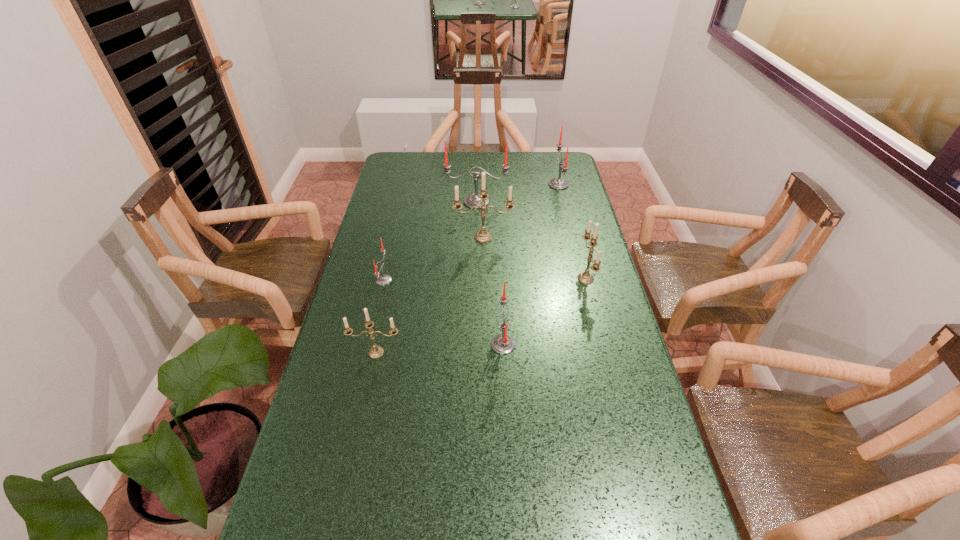
Locate an element on the screen. The width and height of the screenshot is (960, 540). empty location between the rightmost red candle and the second smallest red candle is located at coordinates (531, 265).

Find the location of `unoccupied area between the third smallest red candle and the shortest object`. unoccupied area between the third smallest red candle and the shortest object is located at coordinates (471, 232).

Find the location of `vacant area that lies between the second metallic candle from left to right and the second smallest metallic candle`. vacant area that lies between the second metallic candle from left to right and the second smallest metallic candle is located at coordinates (535, 258).

At what (x,y) coordinates should I click in order to perform the action: click on unoccupied position between the farthest metallic candle and the smallest metallic candle. Please return your answer as a coordinate pair (x, y). This screenshot has width=960, height=540. Looking at the image, I should click on (430, 295).

I want to click on empty space between the third biggest red candle and the second smallest metallic candle, so click(x=544, y=312).

Select which object appears as the fifth closest to the third farthest object. Please provide its 2D coordinates. Your answer should be formatted as a tuple, i.e. [(x, y)], where the tuple contains the x and y coordinates of a point satisfying the conditions above.

[(503, 344)]

Identify which object is the fourth closest to the second farthest metallic candle. Please provide its 2D coordinates. Your answer should be formatted as a tuple, i.e. [(x, y)], where the tuple contains the x and y coordinates of a point satisfying the conditions above.

[(558, 183)]

Identify which candle is the sixth nearest to the second biggest metallic candle. Please provide its 2D coordinates. Your answer should be formatted as a tuple, i.e. [(x, y)], where the tuple contains the x and y coordinates of a point satisfying the conditions above.

[(383, 279)]

Locate which candle ranks fourth in proximity to the second biggest red candle. Please provide its 2D coordinates. Your answer should be formatted as a tuple, i.e. [(x, y)], where the tuple contains the x and y coordinates of a point satisfying the conditions above.

[(503, 344)]

Select which red candle appears as the closest to the rightmost metallic candle. Please provide its 2D coordinates. Your answer should be formatted as a tuple, i.e. [(x, y)], where the tuple contains the x and y coordinates of a point satisfying the conditions above.

[(503, 344)]